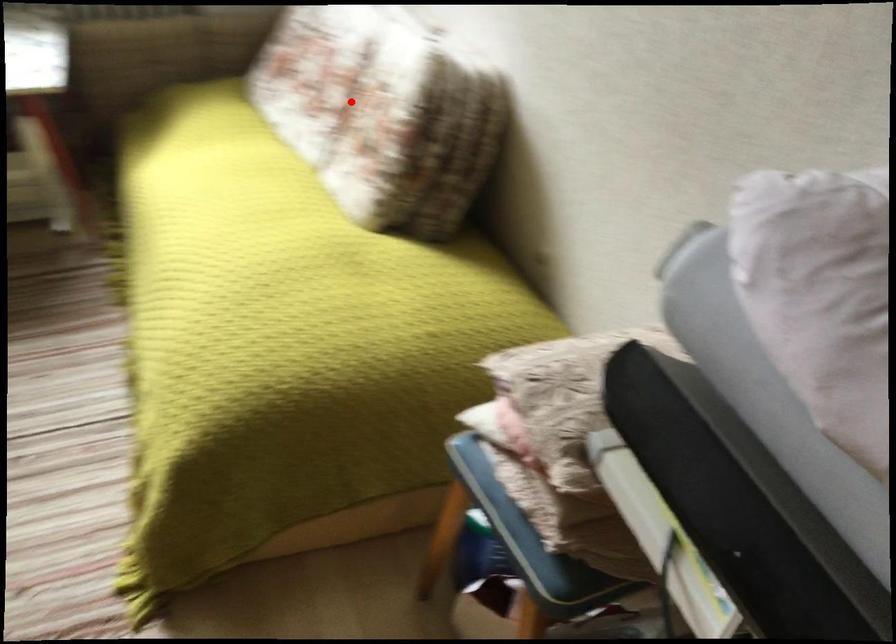
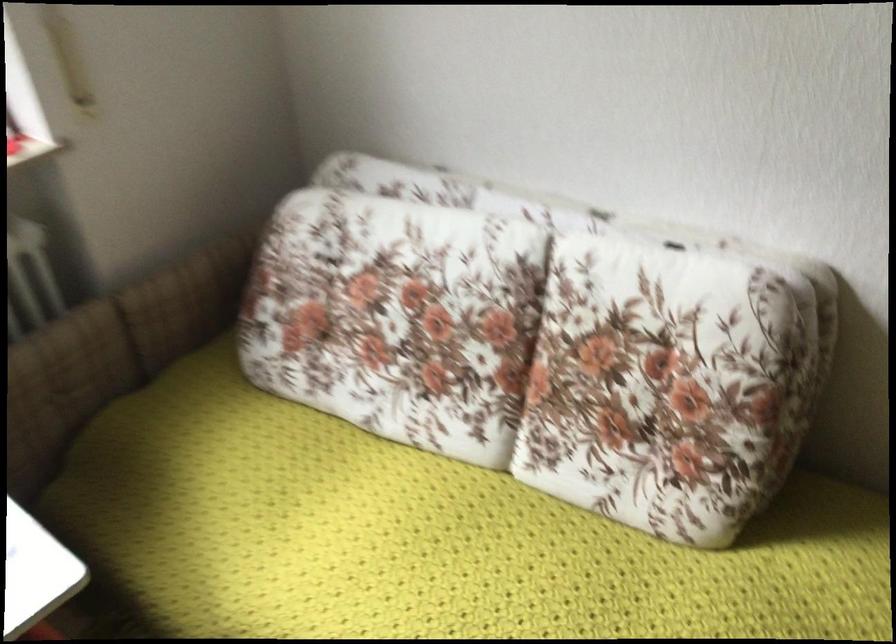
The point at the highlighted location is marked in the first image. Where is the corresponding point in the second image?

(530, 354)